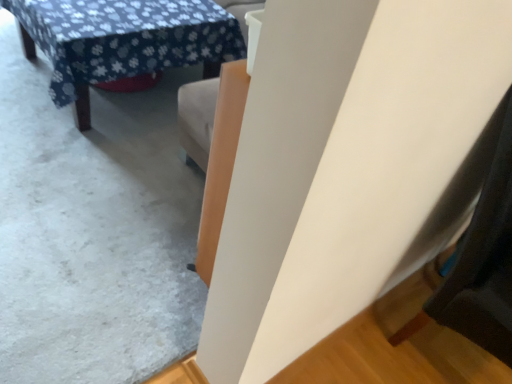
Question: From the image's perspective, is white matte wall at upper center beneath blue floral fabric table at upper left?

Choices:
 (A) yes
 (B) no

Answer: (A)

Question: From a real-world perspective, is white matte wall at upper center over blue floral fabric table at upper left?

Choices:
 (A) no
 (B) yes

Answer: (A)

Question: Is blue floral fabric table at upper left a part of white matte wall at upper center?

Choices:
 (A) yes
 (B) no

Answer: (B)

Question: Is white matte wall at upper center at the right side of blue floral fabric table at upper left?

Choices:
 (A) yes
 (B) no

Answer: (B)

Question: Is white matte wall at upper center at the left side of blue floral fabric table at upper left?

Choices:
 (A) yes
 (B) no

Answer: (A)

Question: Does white matte wall at upper center have a larger size compared to blue floral fabric table at upper left?

Choices:
 (A) no
 (B) yes

Answer: (A)

Question: Does blue floral fabric table at upper left lie in front of white matte wall at upper center?

Choices:
 (A) no
 (B) yes

Answer: (A)

Question: Is blue floral fabric table at upper left oriented away from white matte wall at upper center?

Choices:
 (A) yes
 (B) no

Answer: (B)

Question: From the image's perspective, is blue floral fabric table at upper left beneath white matte wall at upper center?

Choices:
 (A) yes
 (B) no

Answer: (B)

Question: Are blue floral fabric table at upper left and white matte wall at upper center making contact?

Choices:
 (A) yes
 (B) no

Answer: (B)

Question: From a real-world perspective, is blue floral fabric table at upper left on white matte wall at upper center?

Choices:
 (A) yes
 (B) no

Answer: (A)

Question: Can you confirm if blue floral fabric table at upper left is thinner than white matte wall at upper center?

Choices:
 (A) yes
 (B) no

Answer: (A)

Question: Is point (98, 296) positioned closer to the camera than point (223, 54)?

Choices:
 (A) closer
 (B) farther

Answer: (A)